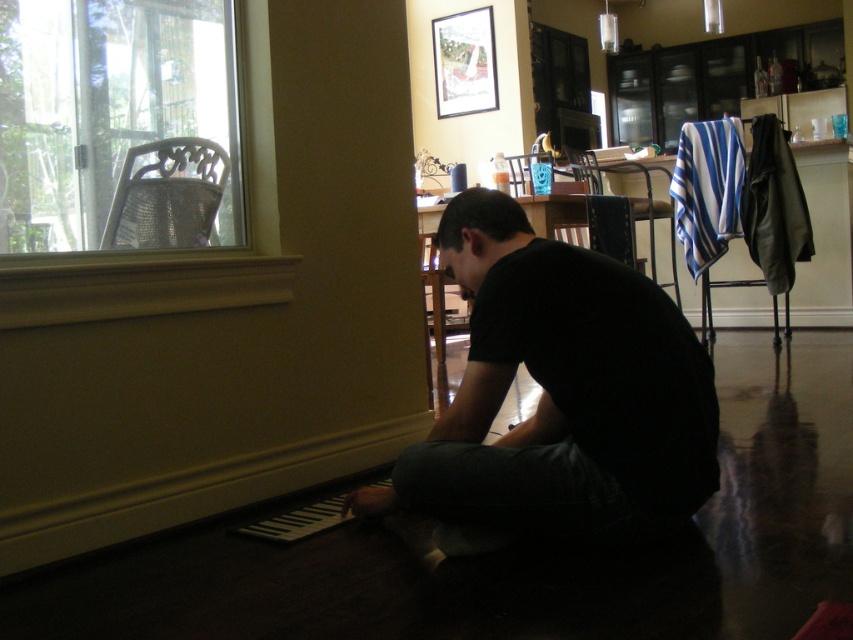
You are standing in the room and want to place a small plant on the floor near the black matte shirt at lower center. According to the coordinates provided, where should you place the plant relative to the shirt?

The black matte shirt at lower center is located at point [560,394], so you should place the plant near those coordinates on the floor relative to the shirt.